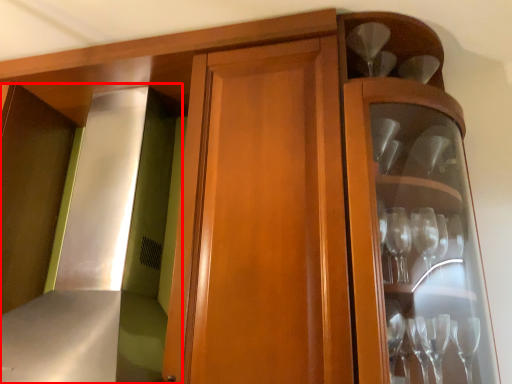
Question: From the image's perspective, what is the correct spatial relationship of exhaust hood (annotated by the red box) in relation to wine glass?

Choices:
 (A) below
 (B) above

Answer: (A)